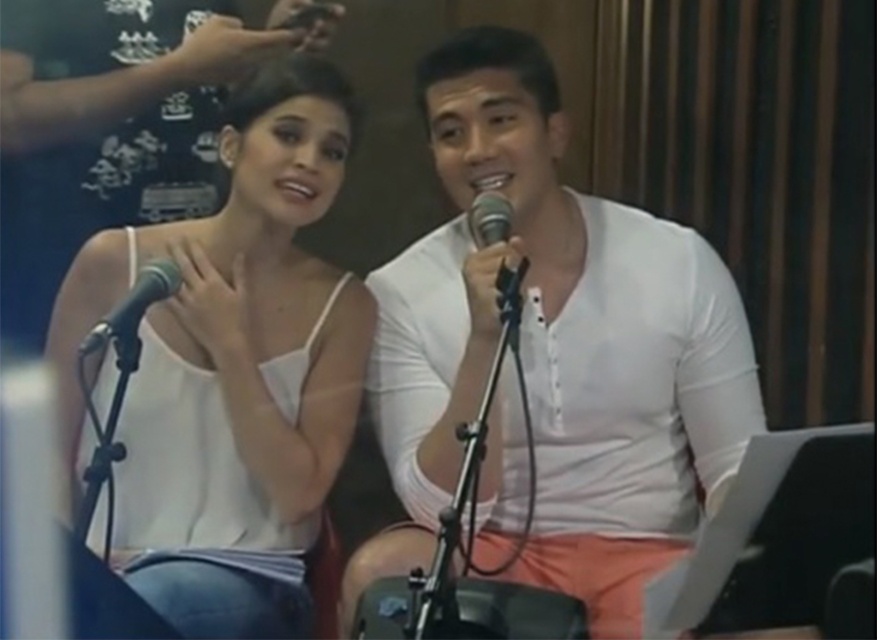
Question: From the image, what is the correct spatial relationship of white smooth shirt at center in relation to black metallic microphone at left?

Choices:
 (A) below
 (B) above

Answer: (A)

Question: Among these points, which one is nearest to the camera?

Choices:
 (A) (122, 305)
 (B) (550, 285)
 (C) (61, 340)
 (D) (469, 209)

Answer: (A)

Question: Which point is closer to the camera taking this photo?

Choices:
 (A) (512, 273)
 (B) (107, 324)
 (C) (329, 396)

Answer: (B)

Question: Where is white smooth shirt at center located in relation to black metallic microphone at left in the image?

Choices:
 (A) left
 (B) right

Answer: (B)

Question: Among these objects, which one is nearest to the camera?

Choices:
 (A) white matte tank top at upper left
 (B) black metallic microphone at center

Answer: (B)

Question: Can you confirm if white matte tank top at upper left is wider than black metallic microphone at left?

Choices:
 (A) yes
 (B) no

Answer: (A)